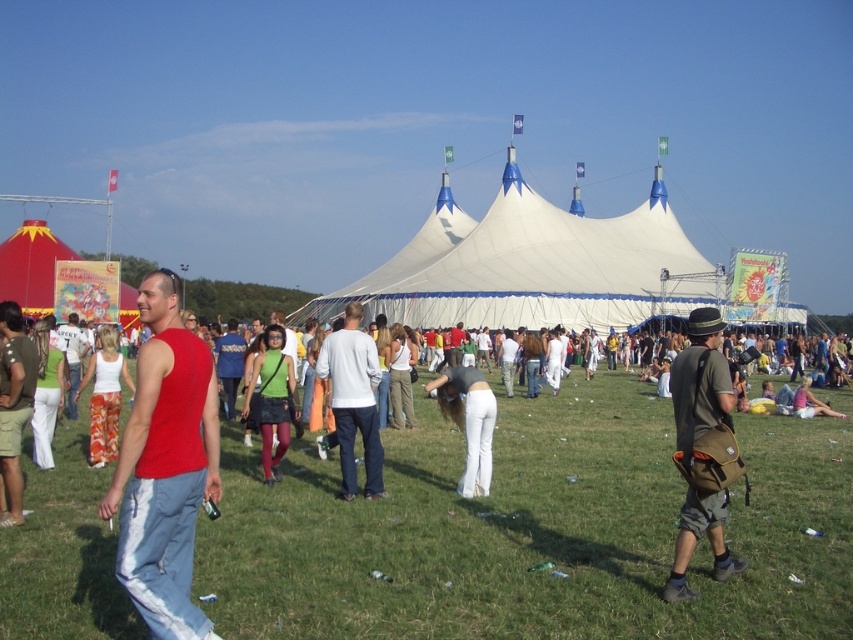
You are a festival attendee holding a brown canvas bag at right and standing on the green grass at center. Can you tell me which surface is wider?

The green grass at center is wider than the brown canvas bag at right according to the description.

You are a photographer at the festival and want to take a photo of the matte red tank top at left without the red fabric tent at left blocking it. What should you do?

The matte red tank top at left is behind the red fabric tent at left, so you should move to a position where the tent is no longer between you and the tank top to capture it without obstruction.

You are at the festival and need to find your friend who is holding a brown canvas bag. You see the green grass at center and the brown canvas bag at right. Which object is taller?

The brown canvas bag at right is taller than the green grass at center.